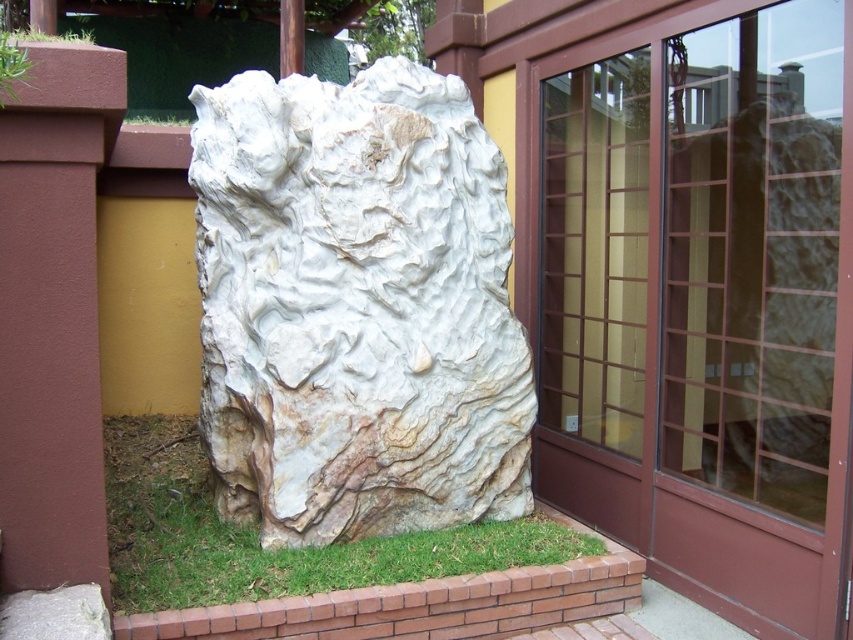
Question: Which object appears farthest from the camera in this image?

Choices:
 (A) green grass at lower left
 (B) transparent glass door at center
 (C) green leafy grass at upper left
 (D) white marble rock at center

Answer: (D)

Question: Estimate the real-world distances between objects in this image. Which object is farther from the transparent glass door at center?

Choices:
 (A) white marble rock at center
 (B) green grass at lower left
 (C) green leafy grass at upper left

Answer: (C)

Question: Does transparent glass door at center lie behind white marble rock at center?

Choices:
 (A) yes
 (B) no

Answer: (B)

Question: Is transparent glass door at center in front of green leafy grass at upper left?

Choices:
 (A) no
 (B) yes

Answer: (A)

Question: Can you confirm if green grass at lower left is positioned to the left of green leafy grass at upper left?

Choices:
 (A) no
 (B) yes

Answer: (A)

Question: Among these points, which one is nearest to the camera?

Choices:
 (A) click(x=682, y=92)
 (B) click(x=318, y=589)
 (C) click(x=4, y=67)
 (D) click(x=465, y=467)

Answer: (C)